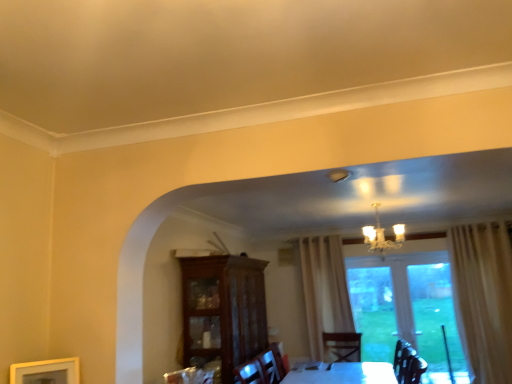
Question: Does gold metallic chandelier at upper center appear on the left side of wooden picture frame at lower left?

Choices:
 (A) no
 (B) yes

Answer: (A)

Question: Is gold metallic chandelier at upper center oriented towards wooden picture frame at lower left?

Choices:
 (A) yes
 (B) no

Answer: (B)

Question: Considering the relative sizes of gold metallic chandelier at upper center and wooden picture frame at lower left in the image provided, is gold metallic chandelier at upper center shorter than wooden picture frame at lower left?

Choices:
 (A) no
 (B) yes

Answer: (A)

Question: From a real-world perspective, is gold metallic chandelier at upper center positioned under wooden picture frame at lower left based on gravity?

Choices:
 (A) yes
 (B) no

Answer: (B)

Question: Is gold metallic chandelier at upper center surrounding wooden picture frame at lower left?

Choices:
 (A) no
 (B) yes

Answer: (A)

Question: Looking at the image, does wooden picture frame at lower left seem bigger or smaller compared to gold metallic chandelier at upper center?

Choices:
 (A) small
 (B) big

Answer: (A)

Question: Is point (53, 364) positioned closer to the camera than point (378, 248)?

Choices:
 (A) farther
 (B) closer

Answer: (B)

Question: From the image's perspective, is wooden picture frame at lower left located above or below gold metallic chandelier at upper center?

Choices:
 (A) below
 (B) above

Answer: (A)

Question: Looking at their shapes, would you say wooden picture frame at lower left is wider or thinner than gold metallic chandelier at upper center?

Choices:
 (A) wide
 (B) thin

Answer: (B)

Question: Is gold metallic chandelier at upper center inside or outside of transparent glass door at center?

Choices:
 (A) outside
 (B) inside

Answer: (A)

Question: Considering the positions of point (397, 241) and point (379, 337), is point (397, 241) closer or farther from the camera than point (379, 337)?

Choices:
 (A) closer
 (B) farther

Answer: (A)

Question: From their relative heights in the image, would you say gold metallic chandelier at upper center is taller or shorter than transparent glass door at center?

Choices:
 (A) tall
 (B) short

Answer: (B)

Question: From a real-world perspective, is gold metallic chandelier at upper center positioned above or below transparent glass door at center?

Choices:
 (A) above
 (B) below

Answer: (A)

Question: Based on their positions, is transparent glass door at center located to the left or right of gold metallic chandelier at upper center?

Choices:
 (A) right
 (B) left

Answer: (A)

Question: Is transparent glass door at center taller or shorter than gold metallic chandelier at upper center?

Choices:
 (A) short
 (B) tall

Answer: (B)